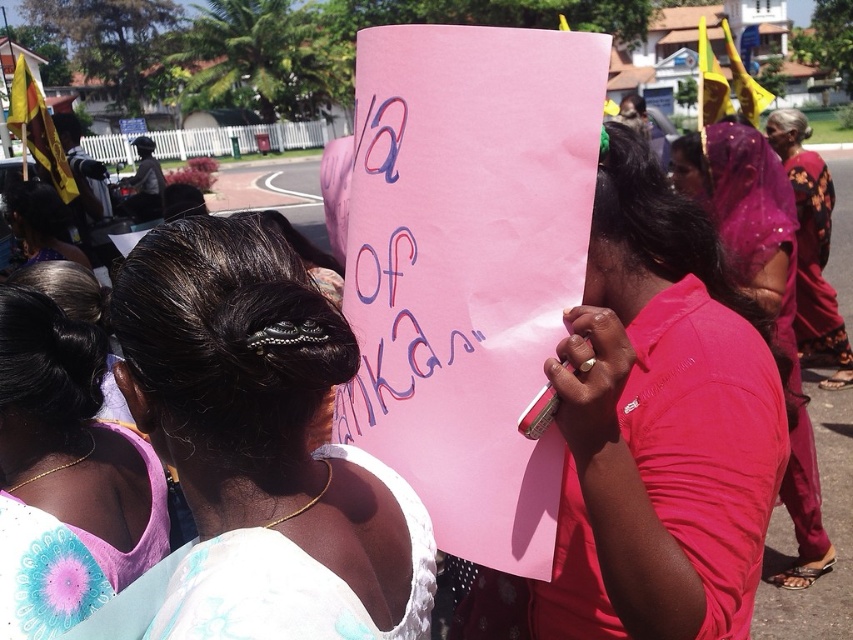
You are a photographer trying to capture a clear shot of the white lace blouse at lower left and the floral silk sari at right. Based on their positions, which clothing item is closer to the camera?

The white lace blouse at lower left is closer to the camera because it is in front of the floral silk sari at right.

You are a photographer trying to capture a photo of the protest scene. You want to include both the white lace blouse at lower left and the floral silk sari at right in your frame. Which clothing item should you position on the left side of your photo to ensure both are visible?

The white lace blouse at lower left should be positioned on the left side of the photo because it is already on the left side of the floral silk sari at right, ensuring both are visible in the frame.